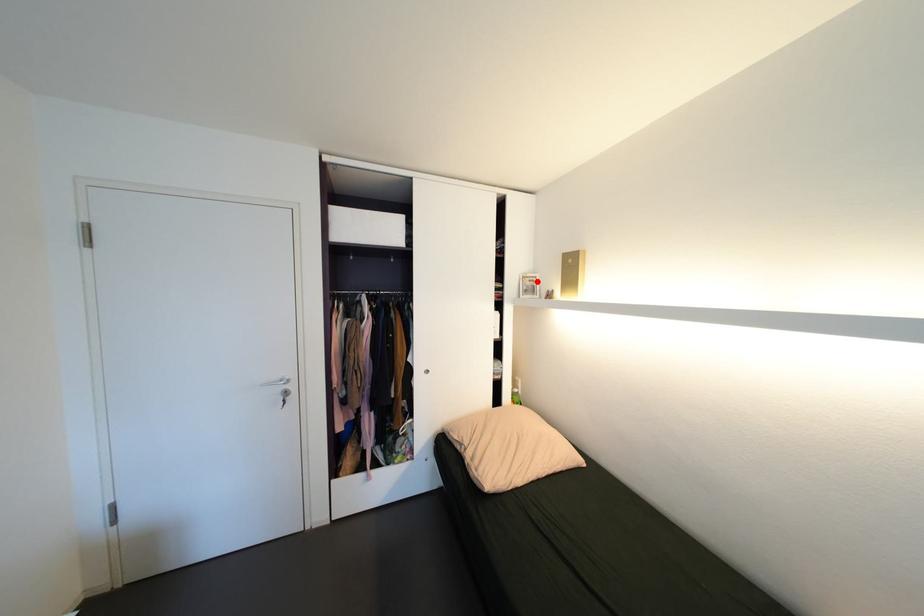
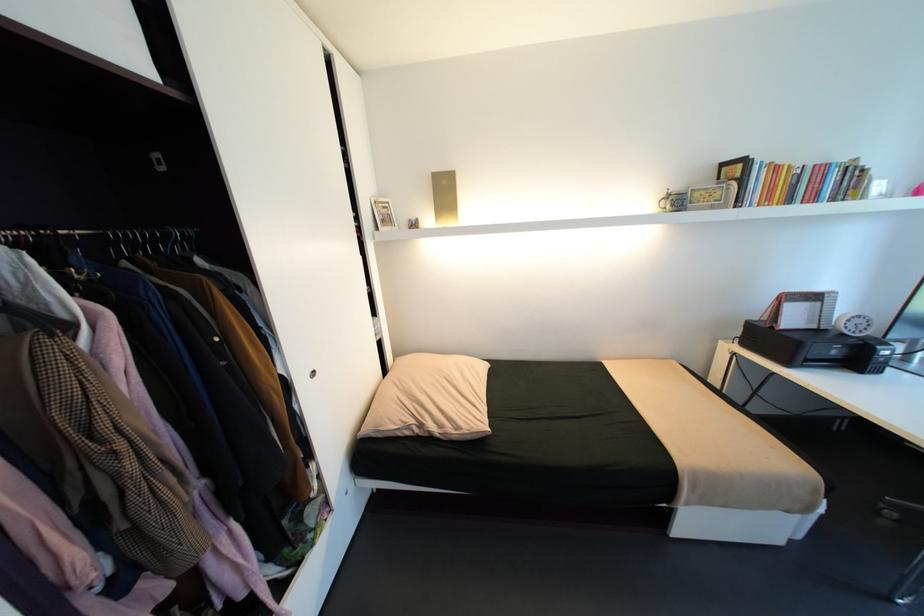
Find the pixel in the second image that matches the highlighted location in the first image.

(392, 208)